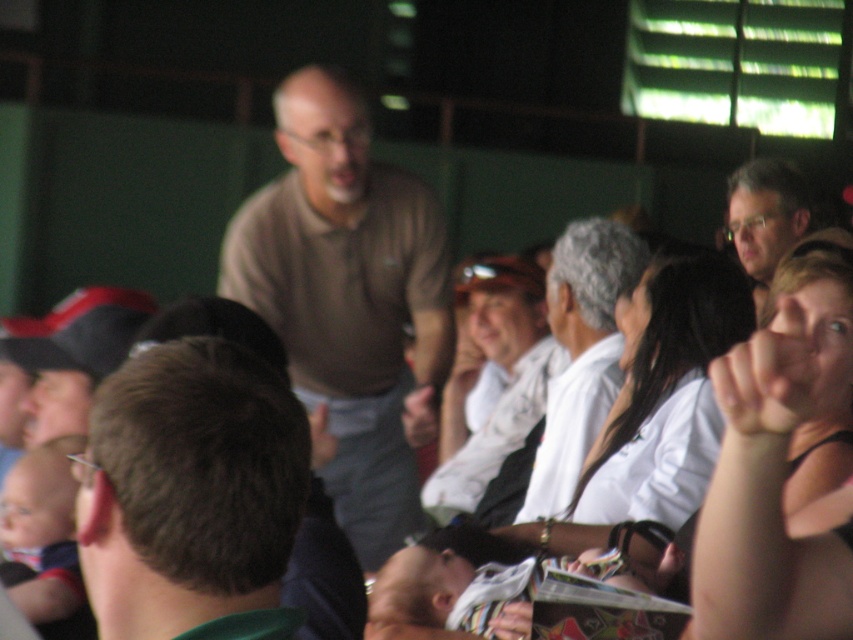
Can you confirm if white silk scarf at center is positioned to the left of white silk shirt at center?

No, white silk scarf at center is not to the left of white silk shirt at center.

Does white silk scarf at center have a larger size compared to white silk shirt at center?

Actually, white silk scarf at center might be smaller than white silk shirt at center.

You are a GUI agent. You are given a task and a screenshot of the screen. Output one action in this format:
    pyautogui.click(x=<x>, y=<y>)
    Task: Click on the white silk scarf at center
    
    Given the screenshot: What is the action you would take?
    pyautogui.click(x=659, y=410)

Is matte black tank top at upper right bigger than matte brown shirt at upper right?

No.

Can you confirm if matte black tank top at upper right is shorter than matte brown shirt at upper right?

No, matte black tank top at upper right is not shorter than matte brown shirt at upper right.

Who is more distant from viewer, (848,532) or (781,182)?

The point (781,182) is behind.

Where is `matte black tank top at upper right`? This screenshot has height=640, width=853. matte black tank top at upper right is located at coordinates (775, 477).

Does white silk shirt at center appear on the left side of matte brown shirt at upper right?

Yes, white silk shirt at center is to the left of matte brown shirt at upper right.

Is point (537, 456) behind point (779, 248)?

No, it is in front of (779, 248).

Is point (625, 243) more distant than point (792, 237)?

No, (625, 243) is in front of (792, 237).

This screenshot has height=640, width=853. I want to click on white silk shirt at center, so click(x=581, y=353).